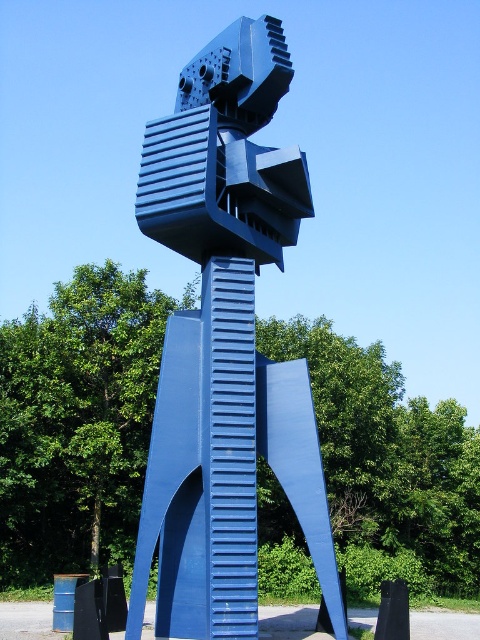
Question: Can you confirm if blue metallic sculpture at center is smaller than metallic blue sculpture at center?

Choices:
 (A) no
 (B) yes

Answer: (A)

Question: Which point is closer to the camera?

Choices:
 (A) blue metallic sculpture at center
 (B) metallic blue sculpture at center

Answer: (B)

Question: Can you confirm if blue metallic sculpture at center is smaller than metallic blue sculpture at center?

Choices:
 (A) no
 (B) yes

Answer: (A)

Question: From the image, what is the correct spatial relationship of blue metallic sculpture at center in relation to metallic blue sculpture at center?

Choices:
 (A) left
 (B) right

Answer: (A)